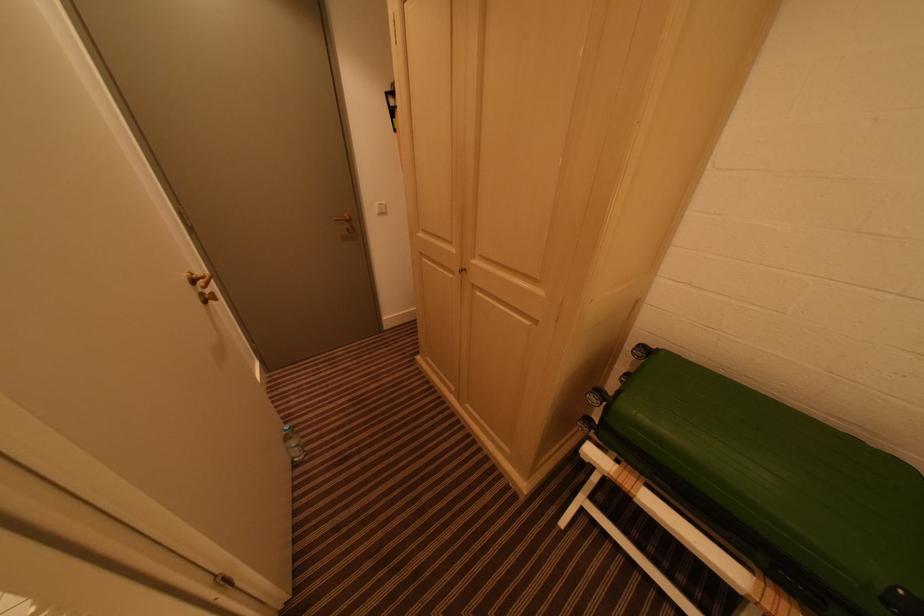
Image resolution: width=924 pixels, height=616 pixels. What are the coordinates of `green suitcase` in the screenshot? It's located at (775, 485).